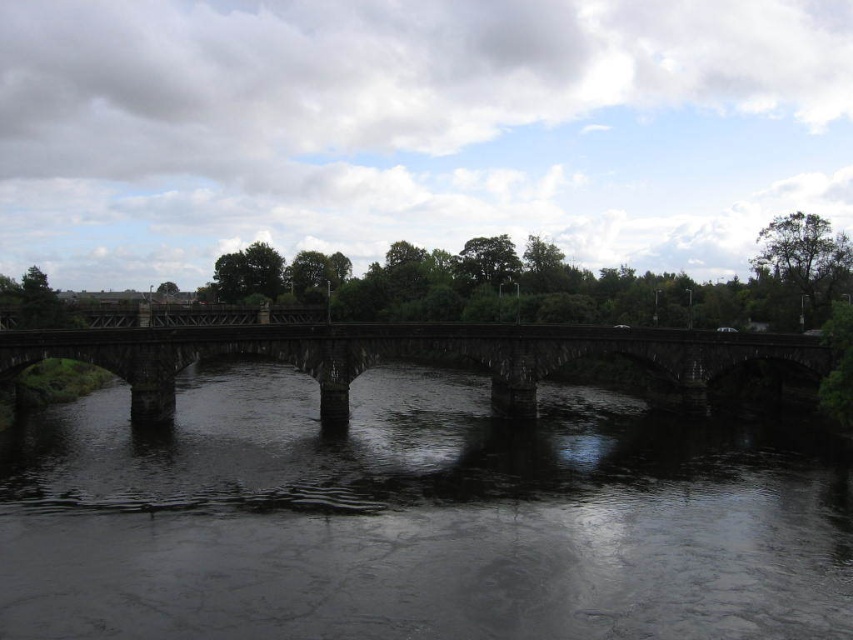
You are a drone operator planning to fly a drone between the dark gray stone bridge at center and the dark stone bridge at center. However, you notice that both objects are actually the same bridge. Why does the image show two instances of the bridge?

The dark gray stone bridge at center and the dark stone bridge at center are actually the same bridge, but due to the reflection on the calm river surface, it appears as two instances. The reflection creates a mirrored image of the bridge below it, making it look like there are two bridges. The distance of 14.19 meters mentioned in the description refers to the gap between the actual bridge and its reflection on the water.

You are a photographer planning to capture the dark gray stone bridge at center and the dark stone bridge at center in a single shot. Which of the two bridges will appear smaller in the photo due to its height?

The dark gray stone bridge at center will appear smaller in the photo because it has a lesser height compared to the dark stone bridge at center.